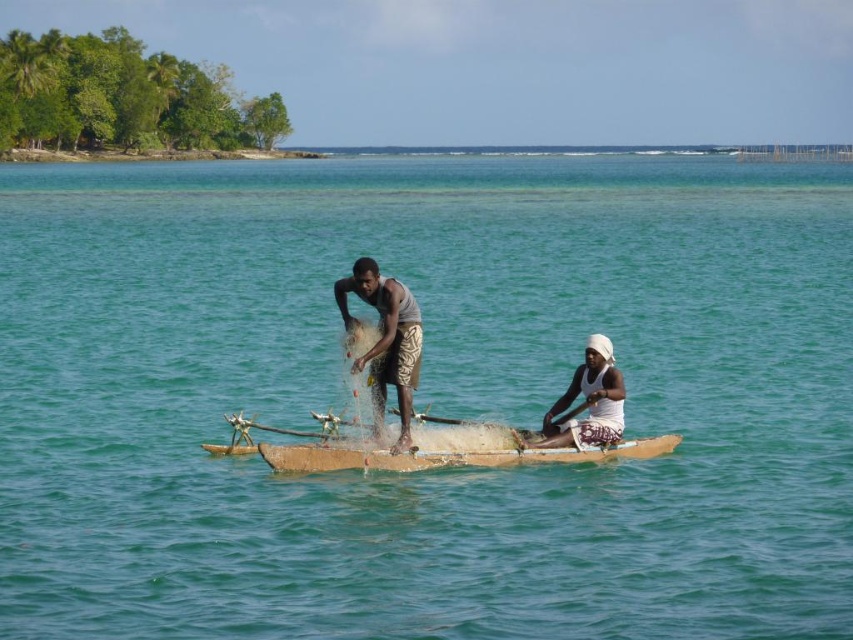
Question: Estimate the real-world distances between objects in this image. Which object is closer to the brown wooden canoe at center?

Choices:
 (A) white woven hat at center
 (B) gray fabric net at center

Answer: (A)

Question: Is gray fabric net at center positioned in front of white woven hat at center?

Choices:
 (A) yes
 (B) no

Answer: (B)

Question: Is brown wooden canoe at center bigger than white woven hat at center?

Choices:
 (A) yes
 (B) no

Answer: (B)

Question: Is brown wooden canoe at center behind white woven hat at center?

Choices:
 (A) no
 (B) yes

Answer: (A)

Question: Which object appears farthest from the camera in this image?

Choices:
 (A) gray fabric net at center
 (B) brown wooden canoe at center
 (C) white woven hat at center

Answer: (A)

Question: Which of the following is the farthest from the observer?

Choices:
 (A) gray fabric net at center
 (B) brown wooden canoe at center

Answer: (A)